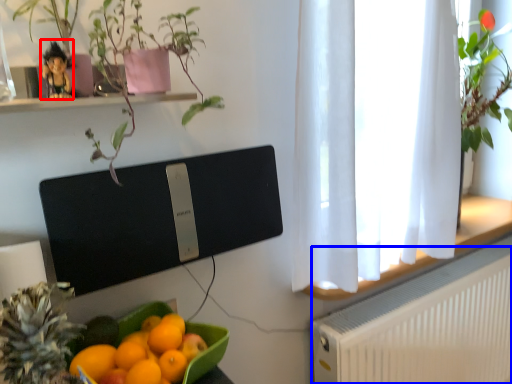
Question: Among these objects, which one is nearest to the camera, toy (highlighted by a red box) or radiator (highlighted by a blue box)?

Choices:
 (A) toy
 (B) radiator

Answer: (A)